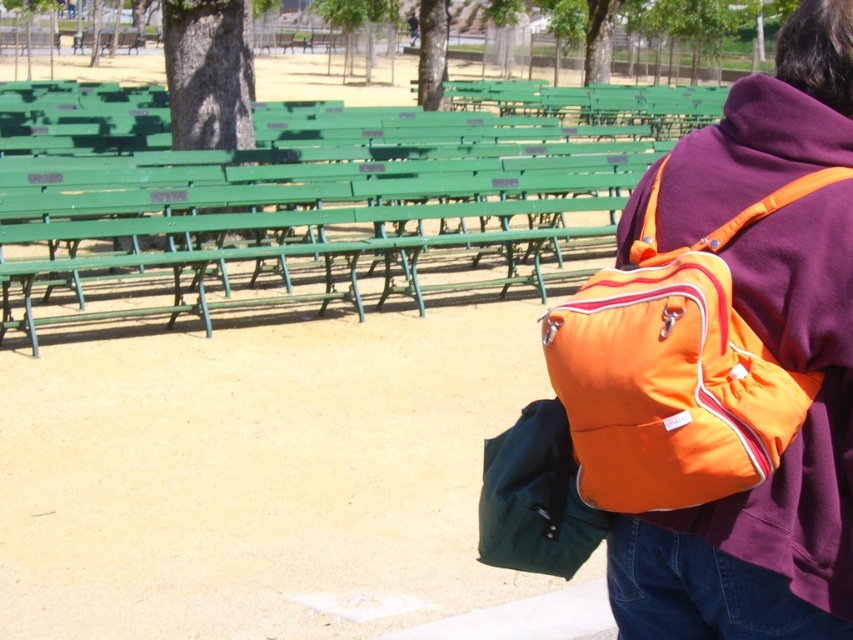
Based on the photo, you are standing at the center of the park and see the orange nylon backpack at right. If you walk straight ahead, will you reach the backpack before the first row of benches?

The orange nylon backpack at right is located at point (x=775, y=470). Since the backpack is positioned further away from the center than the first row of benches, you will reach the first row of benches before the backpack.

You are a park visitor who wants to sit on the green painted wood bench at center. However, there is an orange nylon backpack at right nearby. Can you sit comfortably on the bench without the backpack taking up space?

The green painted wood bench at center is larger in size than the orange nylon backpack at right, so there should be enough space left on the bench for you to sit comfortably.